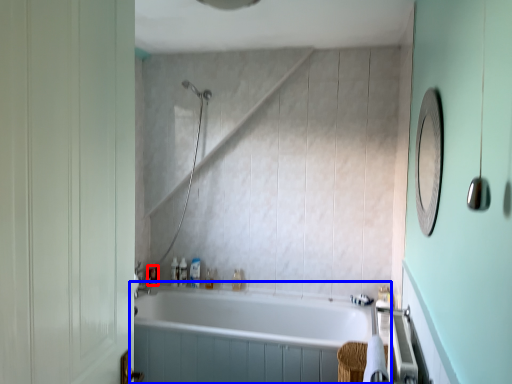
Question: Which object appears closest to the camera in this image, toiletry (highlighted by a red box) or bathtub (highlighted by a blue box)?

Choices:
 (A) toiletry
 (B) bathtub

Answer: (B)